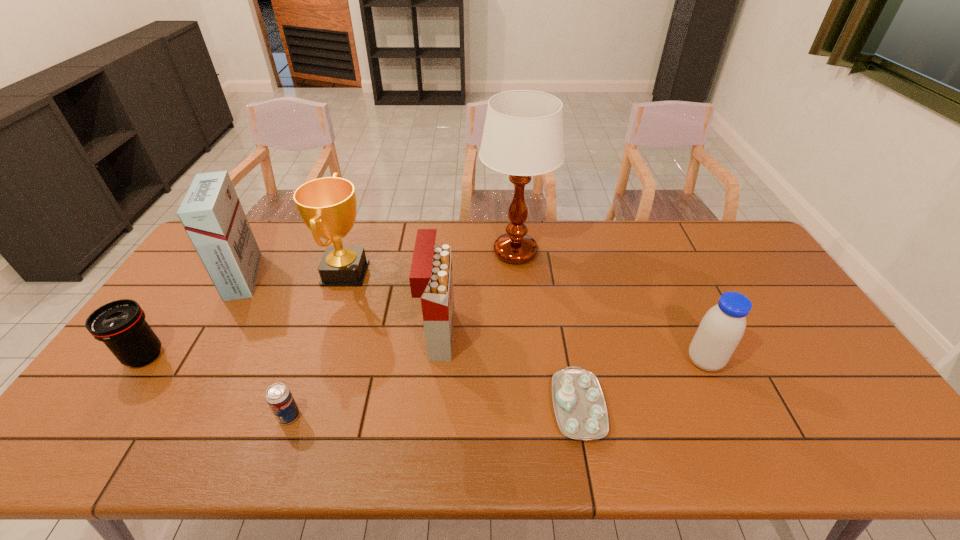
Locate an element on the screen. This screenshot has height=540, width=960. blank region between the chinaware and the second shortest object is located at coordinates coord(433,411).

The width and height of the screenshot is (960, 540). Find the location of `free space between the soya milk and the right cigarette case`. free space between the soya milk and the right cigarette case is located at coordinates (571, 348).

This screenshot has height=540, width=960. Find the location of `object that is the third closest one to the tallest object`. object that is the third closest one to the tallest object is located at coordinates (579, 404).

Locate an element on the screen. Image resolution: width=960 pixels, height=540 pixels. object that stands as the sixth closest to the award is located at coordinates (579, 404).

The height and width of the screenshot is (540, 960). What are the coordinates of `free space that satisfies the following two spatial constraints: 1. with the lid open on the fifth object from left to right; 2. on the back side of the fourth shortest object` in the screenshot? It's located at (436, 361).

Locate an element on the screen. The width and height of the screenshot is (960, 540). free space that satisfies the following two spatial constraints: 1. with the lid open on the soya milk; 2. on the left side of the right cigarette case is located at coordinates (436, 361).

The height and width of the screenshot is (540, 960). In order to click on free location that satisfies the following two spatial constraints: 1. on the back side of the tallest object; 2. on the left side of the beer can in this screenshot , I will do `click(348, 252)`.

The height and width of the screenshot is (540, 960). Identify the location of free location that satisfies the following two spatial constraints: 1. with the lid open on the nearer cigarette case; 2. on the front side of the sixth tallest object. tap(437, 356).